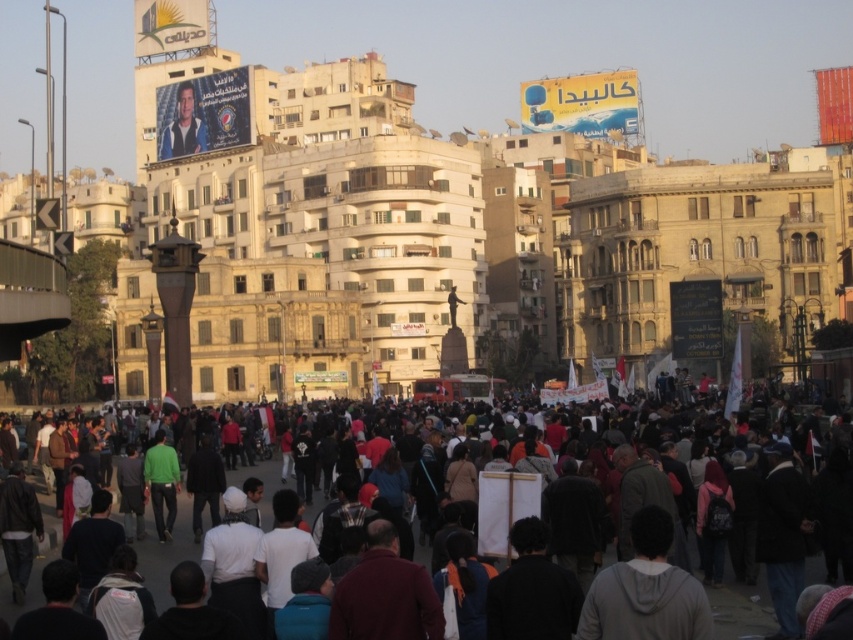
Which is more to the left, dark gray clothing at center or matte black poster at upper left?

Positioned to the left is matte black poster at upper left.

Does dark gray clothing at center appear on the right side of matte black poster at upper left?

Indeed, dark gray clothing at center is positioned on the right side of matte black poster at upper left.

Which is behind, point (631, 413) or point (177, 132)?

Positioned behind is point (177, 132).

This screenshot has height=640, width=853. I want to click on dark gray clothing at center, so click(x=741, y=609).

At what (x,y) coordinates should I click in order to perform the action: click on matte black poster at upper left. Please return your answer as a coordinate pair (x, y). Image resolution: width=853 pixels, height=640 pixels. Looking at the image, I should click on (183, 128).

Which is behind, point (189, 118) or point (451, 323)?

The point (189, 118) is more distant.

This screenshot has height=640, width=853. I want to click on matte black poster at upper left, so click(183, 128).

Does dark gray clothing at center have a larger size compared to silhouette figure at center?

Yes, dark gray clothing at center is bigger than silhouette figure at center.

Which is in front, point (277, 481) or point (456, 291)?

Point (277, 481)

Identify the location of dark gray clothing at center. (741, 609).